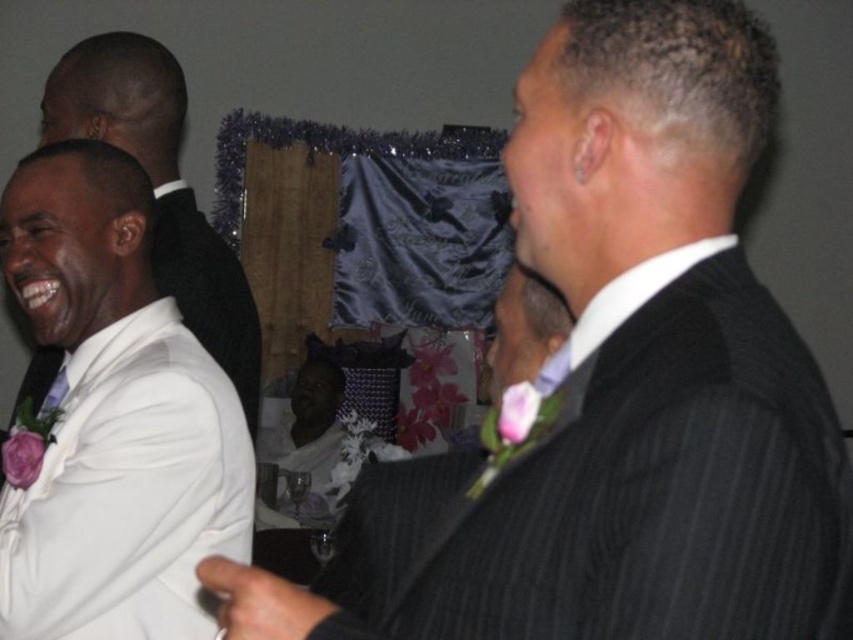
Based on the scene description, where exactly is the white satin suit at left located in the image?

The white satin suit at left is located at point (160, 188).

In the scene shown: You are at the wedding reception and want to find the matte black suit at center. According to the coordinates provided, where should you look?

The matte black suit at center is located at the coordinates point [316,449].